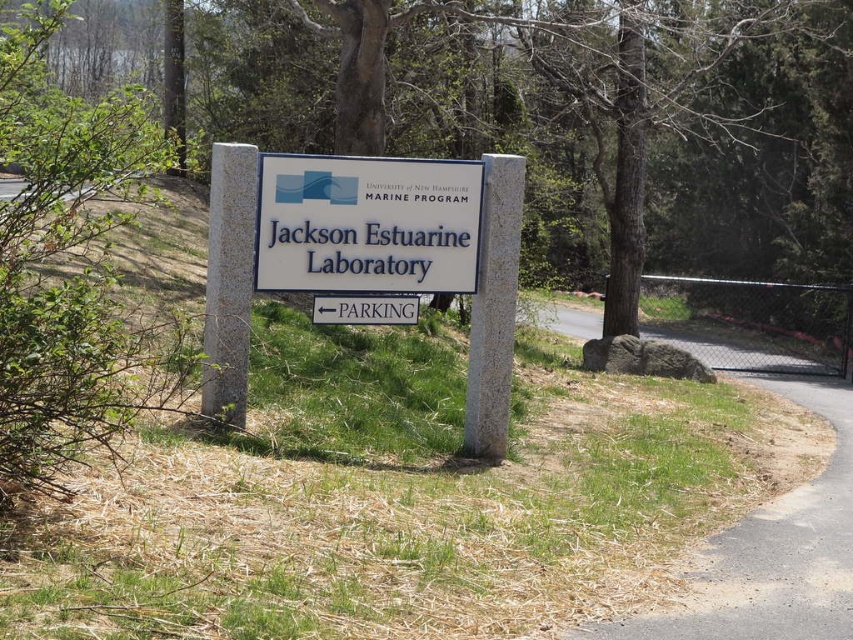
Does point (840, 580) come farther from viewer compared to point (418, 252)?

No, it is in front of (418, 252).

Based on the photo, between asphalt road at lower right and white plastic sign at center, which one has more height?

asphalt road at lower right

Who is more forward, (686, 348) or (354, 214)?

Point (354, 214) is in front.

Identify the location of asphalt road at lower right. (769, 552).